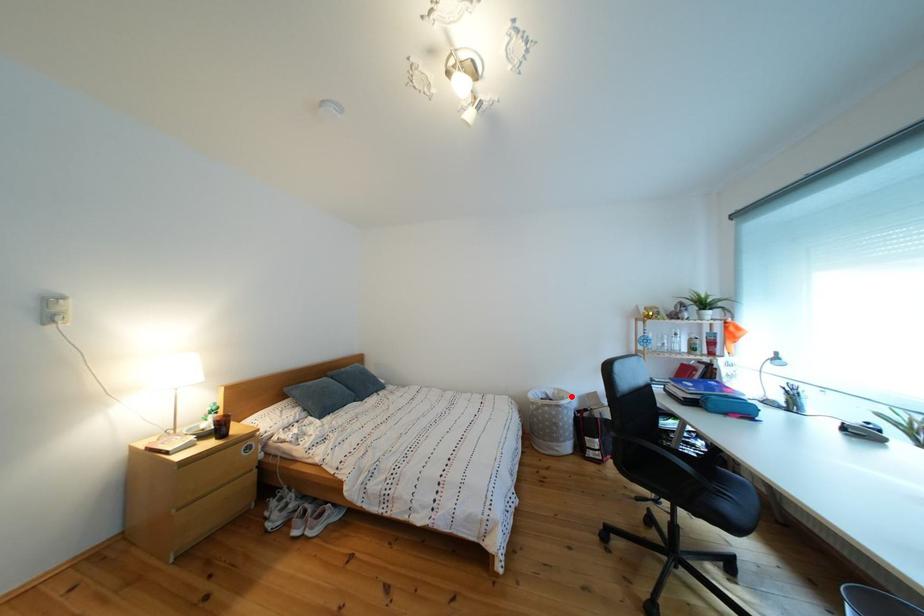
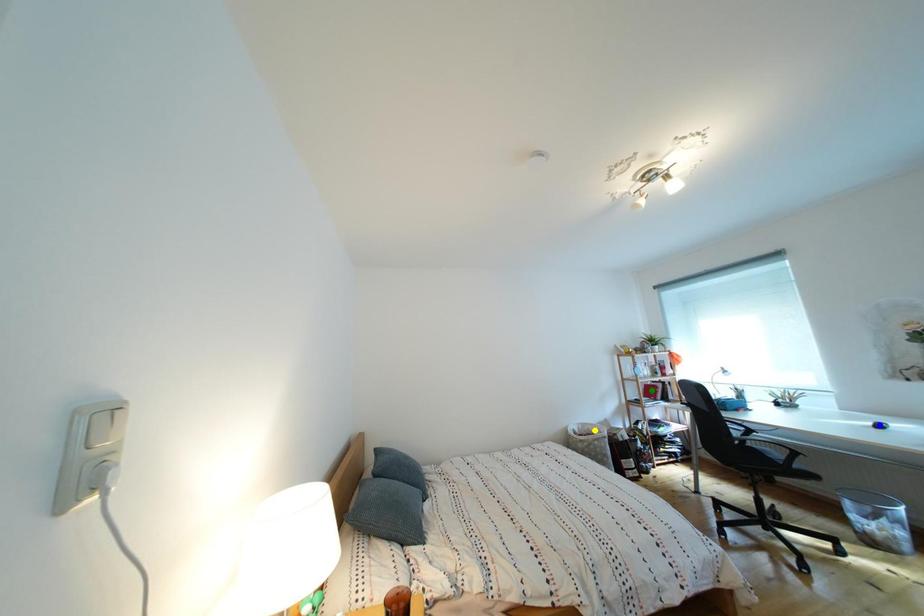
Question: I am providing you with two images of the same scene from different viewpoints. A red point is marked on the first image. You are given multiple points on the second image. In image 2, which mark is for the same physical point as the one in image 1?

Choices:
 (A) blue point
 (B) yellow point
 (C) green point

Answer: (B)